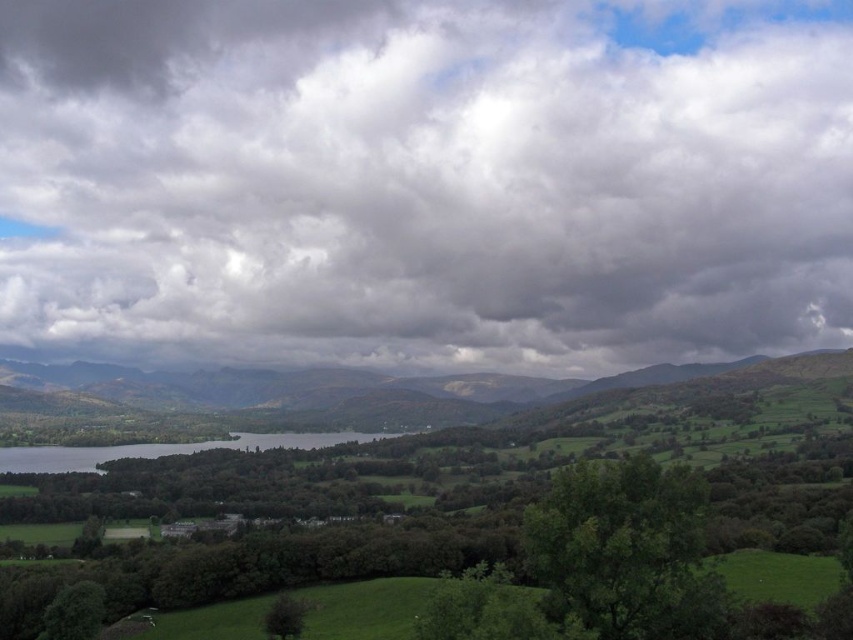
You are standing in the foreground of the scene and want to look up to the cloudy sky at upper center. According to the coordinates provided, what are the x and y values where you should direct your gaze?

The cloudy sky at upper center is located at coordinates x 0.286 and y 0.498, so you should direct your gaze to those exact coordinates to look at it.

You are standing in the middle of the green grassy water at lower left and want to look up to the cloudy sky at upper center. In which direction should you turn your head?

You should turn your head to the right because the cloudy sky at upper center is located to the right of the green grassy water at lower left.